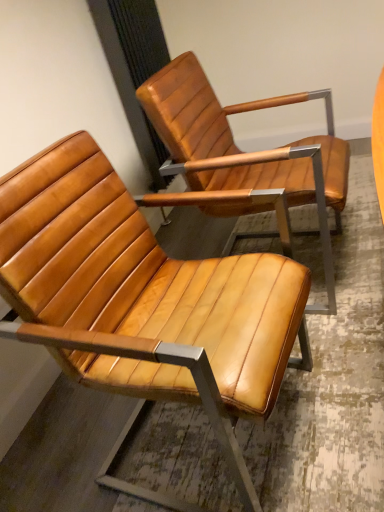
Question: Would you say matte leather chair at center, arranged as the first chair when viewed from the front, is to the left or to the right of matte brown leather chair at upper right, the 1th chair in the back-to-front sequence, in the picture?

Choices:
 (A) left
 (B) right

Answer: (A)

Question: Is matte leather chair at center, arranged as the first chair when viewed from the front, wider or thinner than matte brown leather chair at upper right, the second chair positioned from the front?

Choices:
 (A) thin
 (B) wide

Answer: (A)

Question: Is matte leather chair at center, the second chair from the back, spatially inside matte brown leather chair at upper right, the second chair positioned from the front, or outside of it?

Choices:
 (A) outside
 (B) inside

Answer: (A)

Question: Is point (312, 185) closer or farther from the camera than point (97, 162)?

Choices:
 (A) farther
 (B) closer

Answer: (A)

Question: Looking at their shapes, would you say matte brown leather chair at upper right, the 1th chair in the back-to-front sequence, is wider or thinner than matte leather chair at center, arranged as the first chair when viewed from the front?

Choices:
 (A) wide
 (B) thin

Answer: (A)

Question: Is matte brown leather chair at upper right, the second chair positioned from the front, taller or shorter than matte leather chair at center, the second chair from the back?

Choices:
 (A) tall
 (B) short

Answer: (A)

Question: From the image's perspective, is matte brown leather chair at upper right, the second chair positioned from the front, located above or below matte leather chair at center, the second chair from the back?

Choices:
 (A) above
 (B) below

Answer: (A)